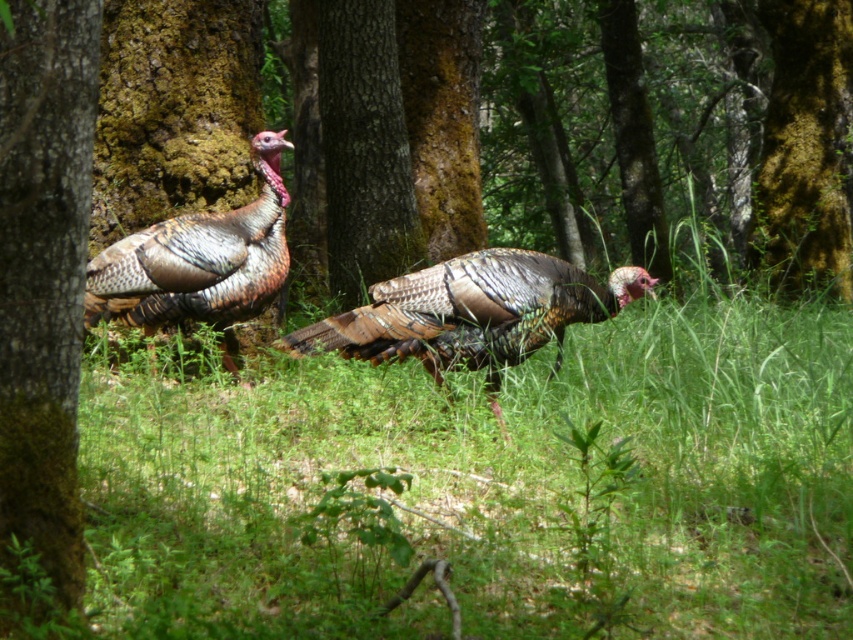
You are a researcher in the forest and need to mark the location of the brown textured bark at left for a study. According to the coordinates provided, where exactly should you place your marker?

The brown textured bark at left should be marked at the coordinates point (x=44, y=276) as specified.

You are a hiker in the forest and see the speckled feathered turkey at left and the green mossy bark at center. Which object is closer to you?

The green mossy bark at center is closer to you because the speckled feathered turkey at left is behind it.